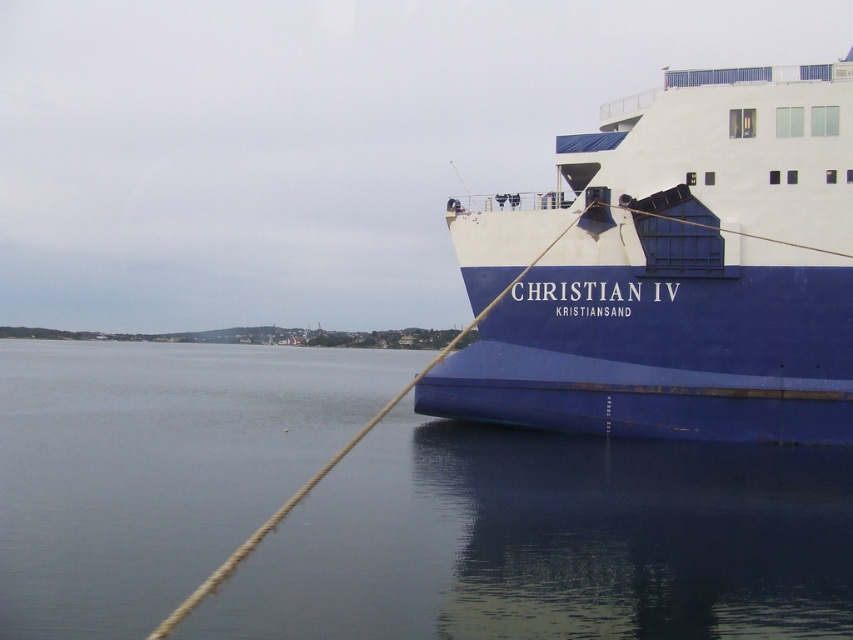
Based on the photo, who is taller, blue water at lower left or rope at right?

Standing taller between the two is rope at right.

What do you see at coordinates (550, 541) in the screenshot? This screenshot has width=853, height=640. I see `blue water at lower left` at bounding box center [550, 541].

Where is `blue water at lower left`? The width and height of the screenshot is (853, 640). blue water at lower left is located at coordinates (550, 541).

How much distance is there between blue matte ship at right and rope at right?

blue matte ship at right is 16.37 feet from rope at right.

Between point (685, 193) and point (544, 250), which one is positioned behind?

Point (544, 250)

Is point (550, 300) farther from viewer compared to point (550, 244)?

Yes, it is behind point (550, 244).

Image resolution: width=853 pixels, height=640 pixels. What are the coordinates of `blue matte ship at right` in the screenshot? It's located at (674, 269).

Between blue water at lower left and blue matte ship at right, which one has less height?

Standing shorter between the two is blue water at lower left.

Is point (100, 586) behind point (828, 237)?

No, (100, 586) is closer to viewer.

Who is more distant from viewer, (207, 358) or (718, 392)?

Positioned behind is point (207, 358).

The width and height of the screenshot is (853, 640). In order to click on blue water at lower left in this screenshot , I will do `click(550, 541)`.